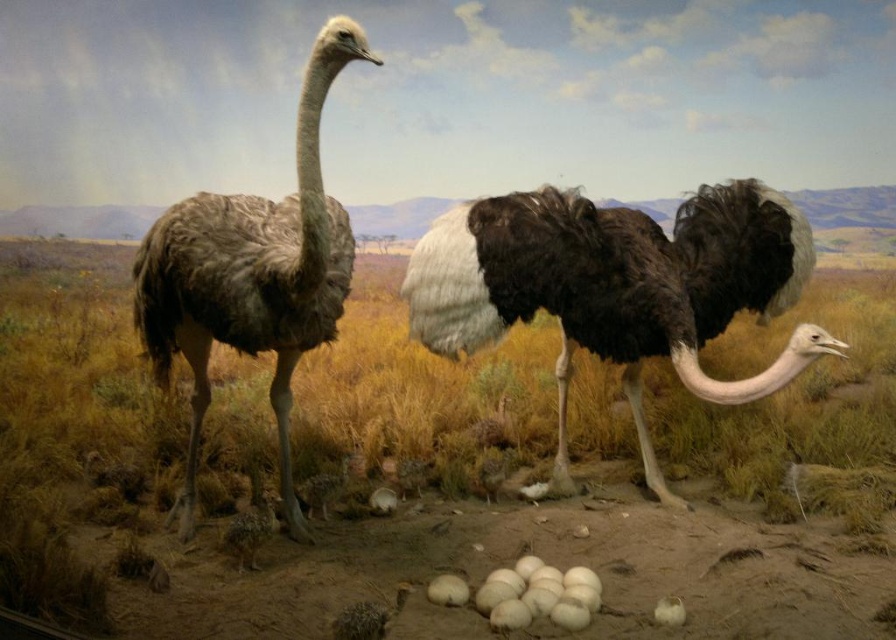
Which is more to the right, brown grass at center or dark brown feathers at center?

Positioned to the right is dark brown feathers at center.

Is point (30, 252) positioned in front of point (696, 264)?

No, (30, 252) is further to viewer.

Locate an element on the screen. This screenshot has width=896, height=640. brown grass at center is located at coordinates (433, 474).

Which of these two, dark brown feathers at center or brown feathered ostrich at left, stands taller?

Standing taller between the two is brown feathered ostrich at left.

Who is more forward, (642, 356) or (333, 276)?

Point (333, 276) is more forward.

Where is `dark brown feathers at center`? This screenshot has height=640, width=896. dark brown feathers at center is located at coordinates (617, 285).

Which is more to the left, brown grass at center or brown feathered ostrich at left?

brown grass at center

Which is behind, point (599, 401) or point (312, 129)?

The point (599, 401) is more distant.

Find the location of a particular element. The width and height of the screenshot is (896, 640). brown grass at center is located at coordinates (433, 474).